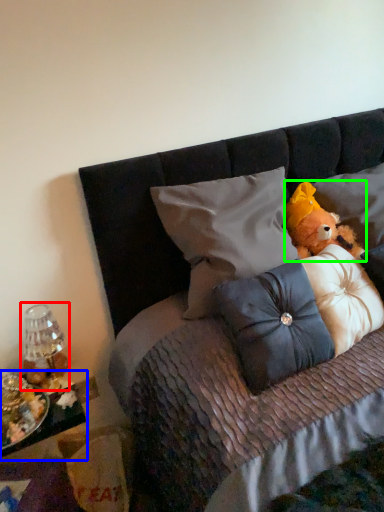
Question: Which object is the farthest from lamp (highlighted by a red box)? Choose among these: table (highlighted by a blue box) or teddy bear (highlighted by a green box).

Choices:
 (A) table
 (B) teddy bear

Answer: (B)